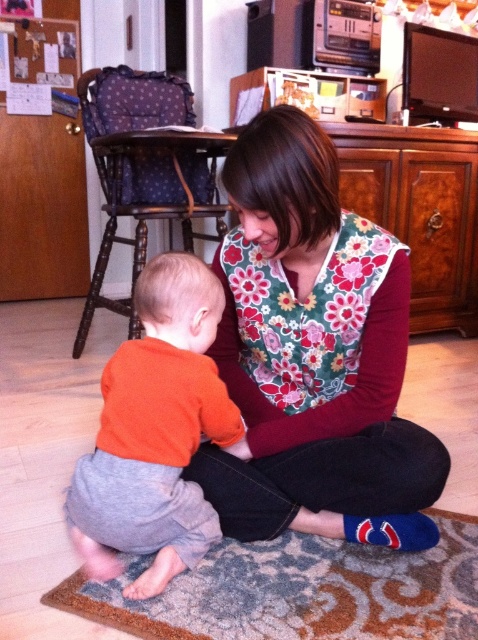
Can you confirm if orange cotton shirt at lower left is smaller than blue fuzzy socks at lower center?

No.

Between orange cotton shirt at lower left and blue fuzzy socks at lower center, which one is positioned lower?

blue fuzzy socks at lower center is below.

In order to click on orange cotton shirt at lower left in this screenshot , I will do `click(155, 433)`.

Is floral fabric shirt at center taller than blue fuzzy socks at lower center?

Yes.

Does floral fabric shirt at center have a larger size compared to blue fuzzy socks at lower center?

Correct, floral fabric shirt at center is larger in size than blue fuzzy socks at lower center.

Is point (219, 504) more distant than point (391, 420)?

That is False.

This screenshot has height=640, width=478. Find the location of `floral fabric shirt at center`. floral fabric shirt at center is located at coordinates (314, 353).

Can you confirm if floral fabric shirt at center is positioned to the left of orange cotton shirt at lower left?

Incorrect, floral fabric shirt at center is not on the left side of orange cotton shirt at lower left.

Does floral fabric shirt at center come behind orange cotton shirt at lower left?

No, it is not.

Who is more distant from viewer, (334, 182) or (158, 420)?

Point (158, 420)

Locate an element on the screen. The image size is (478, 640). floral fabric shirt at center is located at coordinates (314, 353).